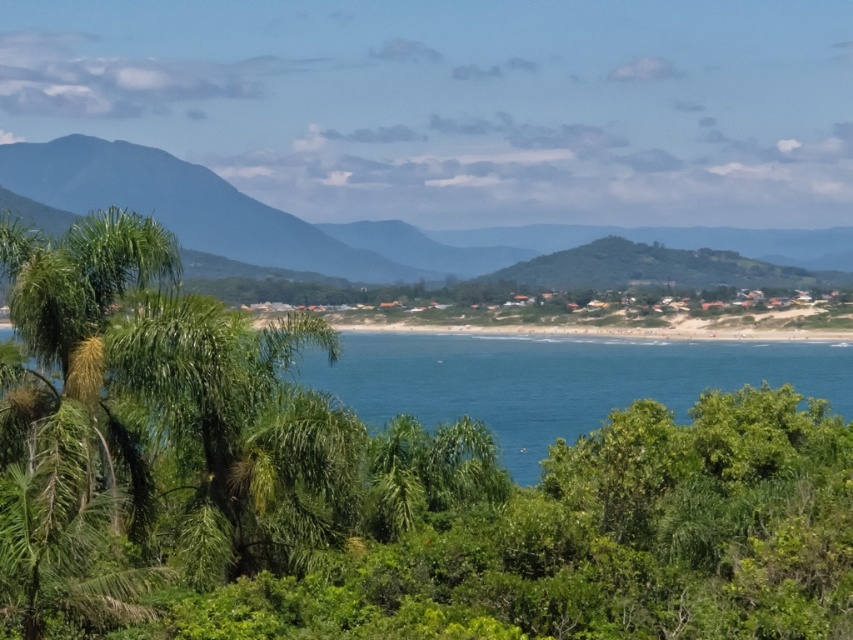
In the scene shown: You are standing on the beach and looking at the blue water at center and the green leafy mountain at center. Which one appears narrower from your perspective?

The blue water at center appears narrower than the green leafy mountain at center.

You are standing on the beach and see the blue water at center and the green leafy mountain at center. Which one appears closer to you?

The blue water at center appears closer to you than the green leafy mountain at center because it is positioned in front of the mountain in the scene.